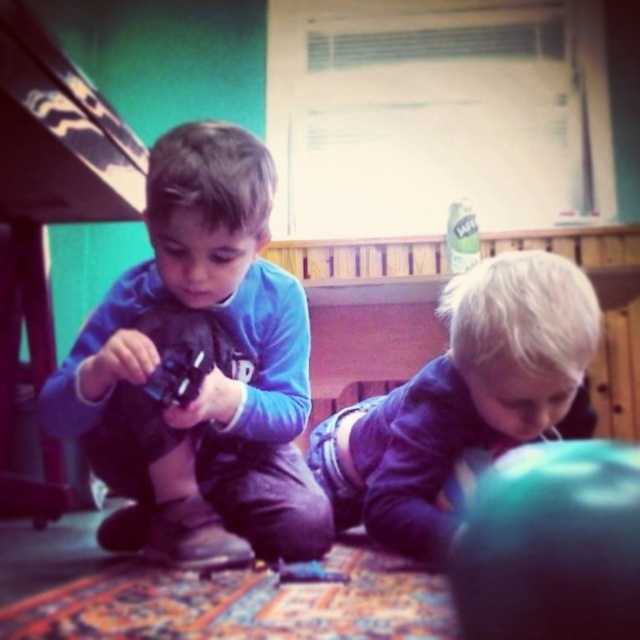
Question: Does matte blue shirt at center come in front of purple denim shorts at lower right?

Choices:
 (A) yes
 (B) no

Answer: (B)

Question: Which of the following is the closest to the observer?

Choices:
 (A) (195, 230)
 (B) (547, 417)

Answer: (B)

Question: Among these points, which one is farthest from the camera?

Choices:
 (A) (236, 520)
 (B) (582, 356)

Answer: (A)

Question: Can you confirm if matte blue shirt at center is positioned to the right of purple denim shorts at lower right?

Choices:
 (A) yes
 (B) no

Answer: (B)

Question: Is matte blue shirt at center to the left of purple denim shorts at lower right from the viewer's perspective?

Choices:
 (A) no
 (B) yes

Answer: (B)